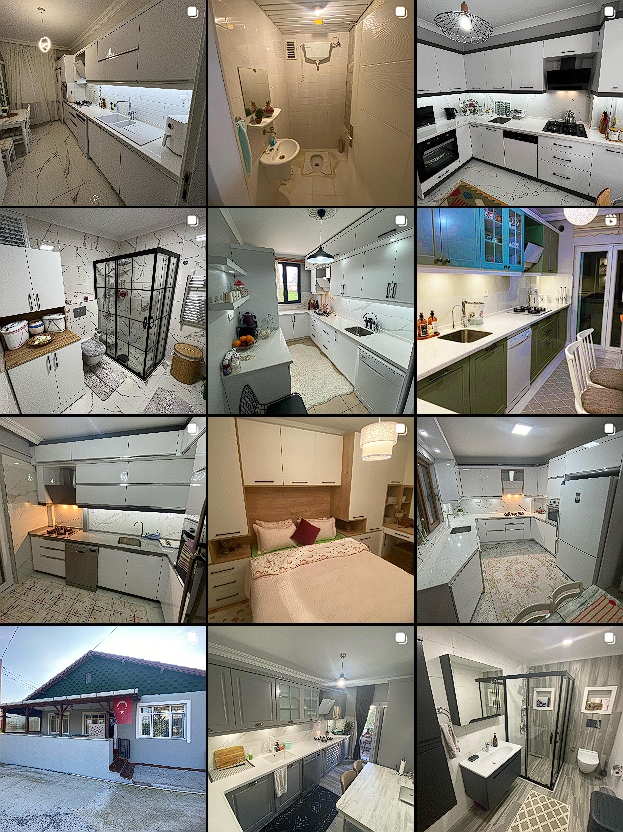
What are the coordinates of `pillows on bed` in the screenshot? It's located at (253, 533), (270, 525), (311, 525), (321, 526), (319, 514).